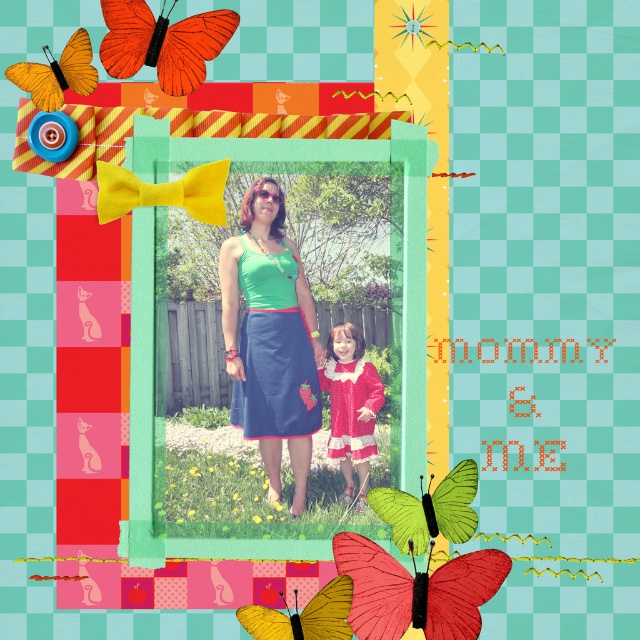
Question: Estimate the real-world distances between objects in this image. Which object is closer to the matte red dress at center?

Choices:
 (A) green fabric picture frame at center
 (B) orange matte butterfly at upper left
 (C) yellow matte butterfly at lower center
 (D) matte green fabric dress at center

Answer: (D)

Question: Can you confirm if red matte butterfly at center is wider than yellow matte butterfly at lower center?

Choices:
 (A) yes
 (B) no

Answer: (A)

Question: Which of the following is the closest to the observer?

Choices:
 (A) [33, 67]
 (B) [122, 8]

Answer: (B)

Question: Is matte green fabric dress at center behind yellow matte butterfly at lower center?

Choices:
 (A) no
 (B) yes

Answer: (B)

Question: Which point is farther to the camera?

Choices:
 (A) matte red dress at center
 (B) red matte butterfly at center

Answer: (A)

Question: Is red matte butterfly at center thinner than orange paper butterfly at upper left?

Choices:
 (A) no
 (B) yes

Answer: (A)